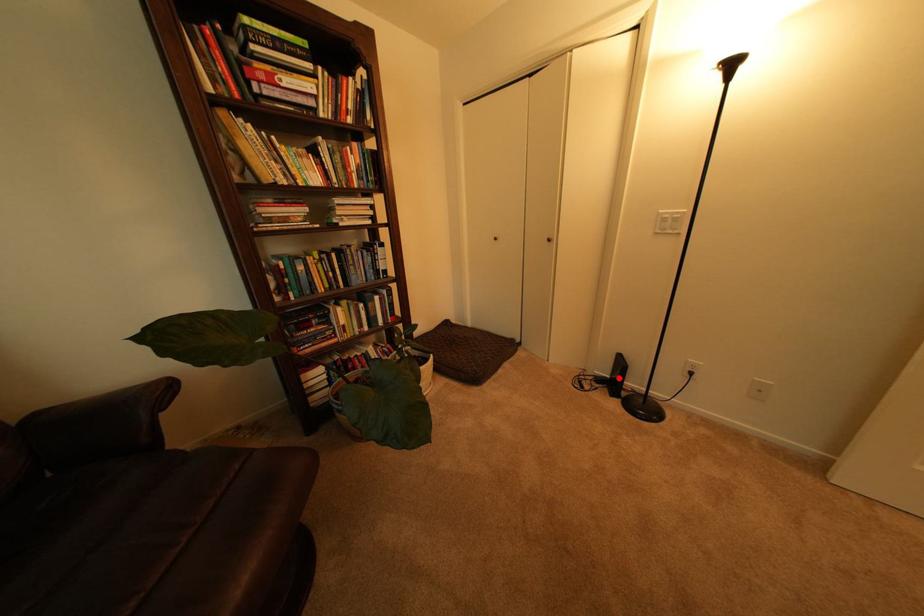
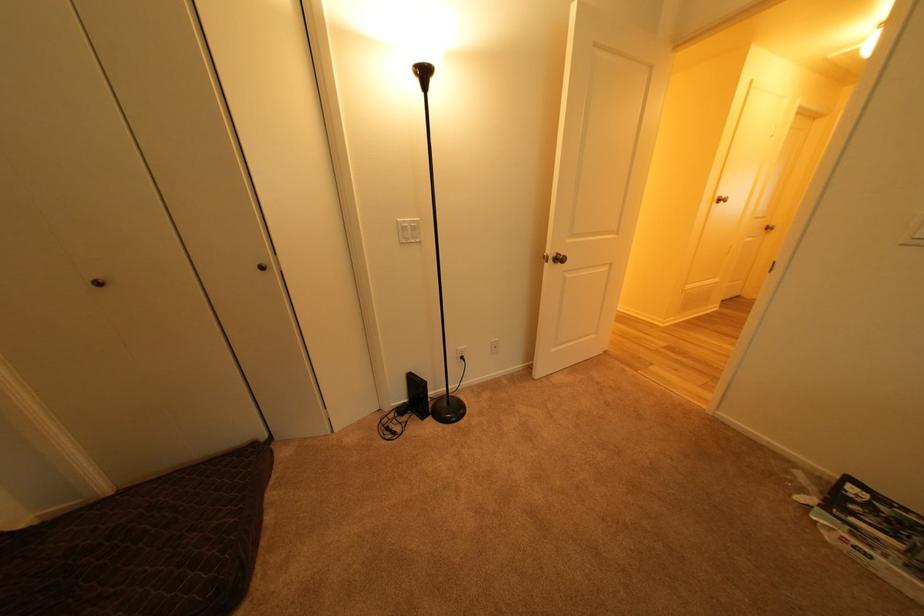
Question: I am providing you with two images of the same scene from different viewpoints. Image1 has a red point marked. In image2, the corresponding 3D location appears at what relative position? Reply with the corresponding letter.

Choices:
 (A) Closer
 (B) Farther

Answer: (B)